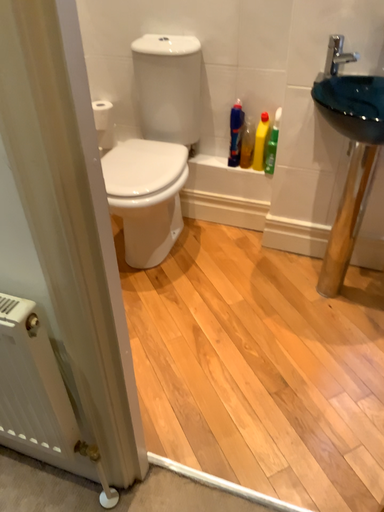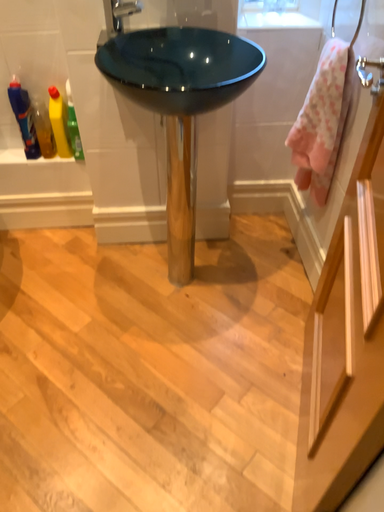
Question: How did the camera likely rotate when shooting the video?

Choices:
 (A) rotated left
 (B) rotated right

Answer: (B)